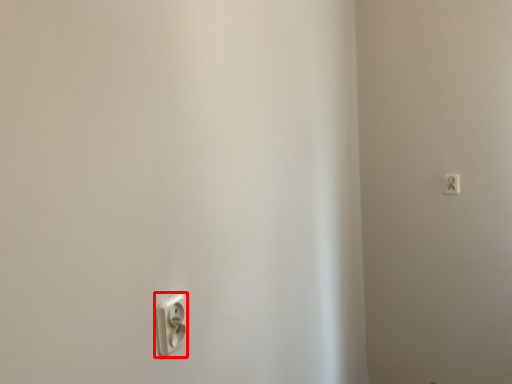
Question: From the image's perspective, where is power plugs and sockets (annotated by the red box) located in relation to power plugs and sockets in the image?

Choices:
 (A) below
 (B) above

Answer: (A)